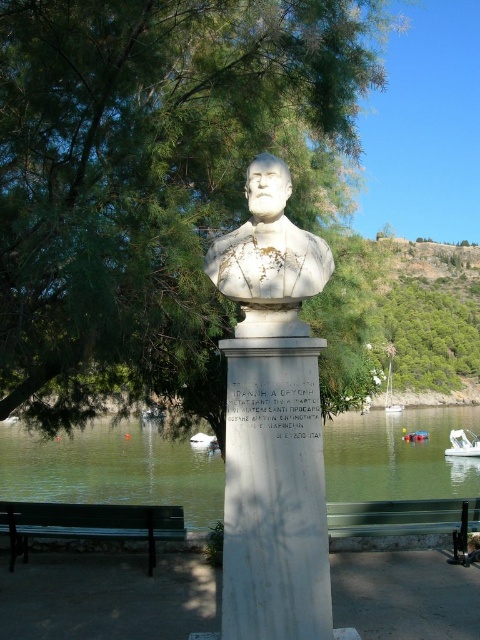
In the scene shown: You are an art conservator who needs to move the green painted wood bench at lower left closer to the white stone bust at center for easier access. The minimum safe distance between them should be 3 meters to avoid damaging the artwork. Can you move the bench closer without violating this safety guideline?

The white stone bust at center is currently 4.71 meters away from the green painted wood bench at lower left. Since the minimum safe distance required is 3 meters, you can move the bench closer to within 3 meters while still maintaining the safety guideline.

You are standing at the point marked by the coordinates point (156, 176), which is the green leafy tree at upper left. What is the nearest object to you in the scene?

The nearest object to you is the green leafy tree at upper left since you are standing at its marked coordinates.